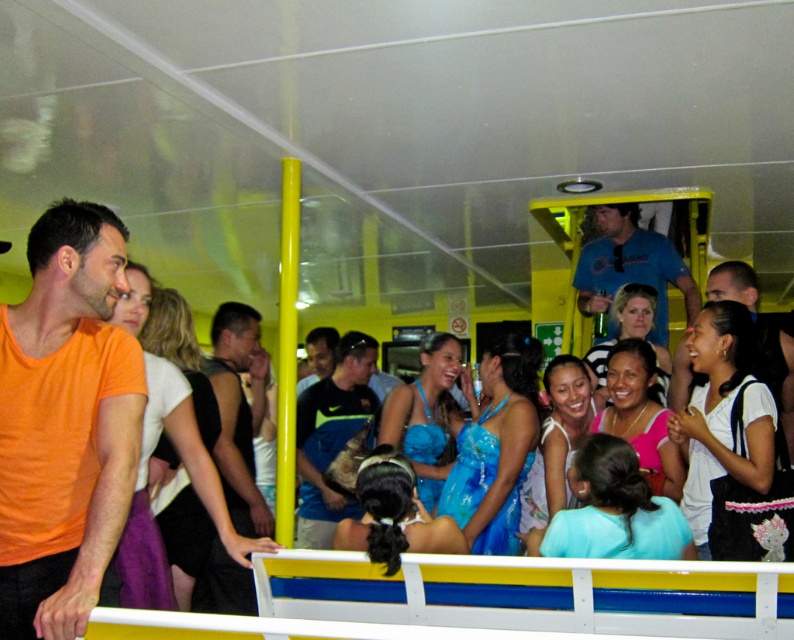
Question: Which point is closer to the camera?

Choices:
 (A) blue fabric shirt at center
 (B) blue t-shirt at upper right
 (C) orange matte t-shirt at center

Answer: (C)

Question: From the image, what is the correct spatial relationship of orange matte t-shirt at center in relation to blue t-shirt at upper right?

Choices:
 (A) above
 (B) below

Answer: (B)

Question: Considering the relative positions of orange matte t-shirt at center and blue fabric shirt at center in the image provided, where is orange matte t-shirt at center located with respect to blue fabric shirt at center?

Choices:
 (A) right
 (B) left

Answer: (B)

Question: Which of the following is the closest to the observer?

Choices:
 (A) (596, 275)
 (B) (56, 596)
 (C) (295, 452)

Answer: (B)

Question: Which of the following is the farthest from the observer?

Choices:
 (A) (33, 486)
 (B) (611, 250)

Answer: (B)

Question: Can you confirm if blue fabric shirt at center is smaller than blue t-shirt at upper right?

Choices:
 (A) no
 (B) yes

Answer: (A)